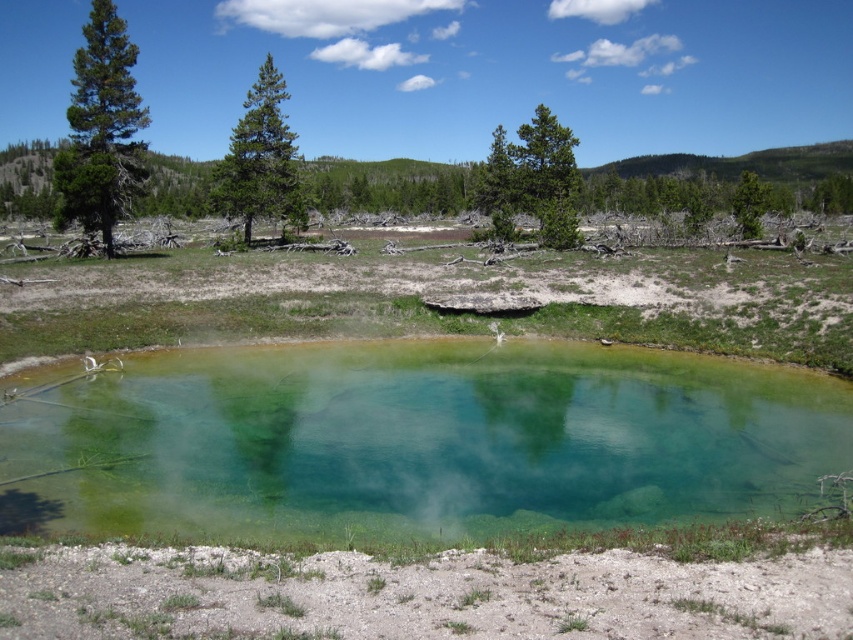
Is green pine tree at left positioned at the back of green matte tree at upper right?

No, it is not.

What do you see at coordinates (102, 129) in the screenshot? The height and width of the screenshot is (640, 853). I see `green pine tree at left` at bounding box center [102, 129].

What are the coordinates of `green pine tree at left` in the screenshot? It's located at (102, 129).

Is green rough bark tree at upper center to the right of green matte tree at upper right from the viewer's perspective?

No, green rough bark tree at upper center is not to the right of green matte tree at upper right.

Can you confirm if green rough bark tree at upper center is positioned above green matte tree at upper right?

No, green rough bark tree at upper center is not above green matte tree at upper right.

Is point (570, 218) positioned before point (746, 180)?

Yes.

In order to click on green rough bark tree at upper center in this screenshot , I will do click(x=532, y=179).

Who is positioned more to the left, green translucent water at center or green rough bark tree at upper center?

green translucent water at center is more to the left.

Who is more forward, (416, 525) or (552, 122)?

Point (416, 525) is more forward.

Locate an element on the screen. This screenshot has height=640, width=853. green translucent water at center is located at coordinates (415, 442).